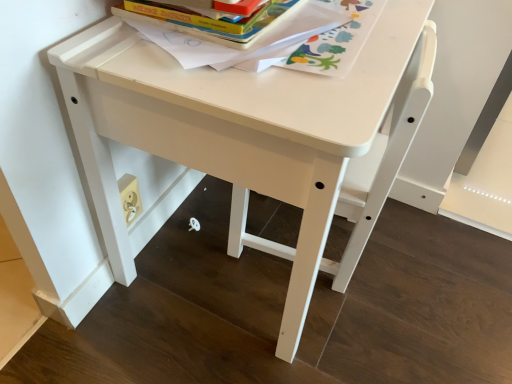
This screenshot has height=384, width=512. Identify the location of vacant area on top of white plastic chair at center (from a real-world perspective). (352, 30).